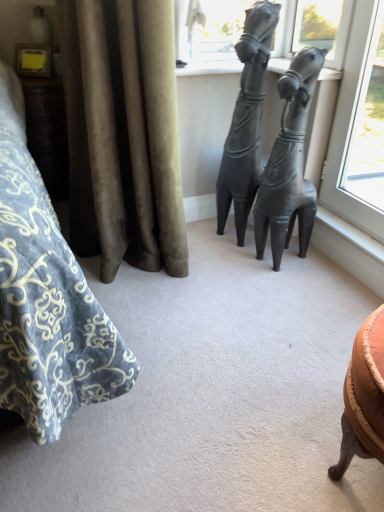
Question: From a real-world perspective, is velvet curtain at left under matte black statue at center, which appears as the first statue (sculpture) when viewed from the right?

Choices:
 (A) yes
 (B) no

Answer: (B)

Question: From the image's perspective, is velvet curtain at left located beneath matte black statue at center, positioned as the 2th statue (sculpture) in left-to-right order?

Choices:
 (A) yes
 (B) no

Answer: (B)

Question: Can you confirm if velvet curtain at left is shorter than matte black statue at center, positioned as the 2th statue (sculpture) in left-to-right order?

Choices:
 (A) yes
 (B) no

Answer: (A)

Question: Are velvet curtain at left and matte black statue at center, which appears as the first statue (sculpture) when viewed from the right, located far from each other?

Choices:
 (A) no
 (B) yes

Answer: (A)

Question: Is velvet curtain at left looking in the opposite direction of matte black statue at center, positioned as the 2th statue (sculpture) in left-to-right order?

Choices:
 (A) yes
 (B) no

Answer: (A)

Question: Is matte black statue at center, which appears as the first statue (sculpture) when viewed from the right, bigger or smaller than velvet curtain at left?

Choices:
 (A) small
 (B) big

Answer: (A)

Question: In the image, is matte black statue at center, positioned as the 2th statue (sculpture) in left-to-right order, positioned in front of or behind velvet curtain at left?

Choices:
 (A) behind
 (B) front

Answer: (A)

Question: From the image's perspective, is matte black statue at center, which appears as the first statue (sculpture) when viewed from the right, above or below velvet curtain at left?

Choices:
 (A) above
 (B) below

Answer: (B)

Question: Is matte black statue at center, which appears as the first statue (sculpture) when viewed from the right, to the left or to the right of velvet curtain at left in the image?

Choices:
 (A) left
 (B) right

Answer: (B)

Question: Considering their positions, is matte black statue at center, the first statue (sculpture) in the left-to-right sequence, located in front of or behind velvet curtain at left?

Choices:
 (A) front
 (B) behind

Answer: (B)

Question: In terms of width, does matte black statue at center, acting as the second statue (sculpture) starting from the right, look wider or thinner when compared to velvet curtain at left?

Choices:
 (A) thin
 (B) wide

Answer: (A)

Question: Is matte black statue at center, the first statue (sculpture) in the left-to-right sequence, inside or outside of velvet curtain at left?

Choices:
 (A) inside
 (B) outside

Answer: (B)

Question: Considering the relative positions of matte black statue at center, acting as the second statue (sculpture) starting from the right, and velvet curtain at left in the image provided, is matte black statue at center, acting as the second statue (sculpture) starting from the right, to the left or to the right of velvet curtain at left?

Choices:
 (A) left
 (B) right

Answer: (B)

Question: From the image's perspective, relative to matte black statue at center, the first statue (sculpture) in the left-to-right sequence, is velvet curtain at left above or below?

Choices:
 (A) above
 (B) below

Answer: (A)

Question: Considering the positions of velvet curtain at left and matte black statue at center, acting as the second statue (sculpture) starting from the right, in the image, is velvet curtain at left taller or shorter than matte black statue at center, acting as the second statue (sculpture) starting from the right,?

Choices:
 (A) short
 (B) tall

Answer: (A)